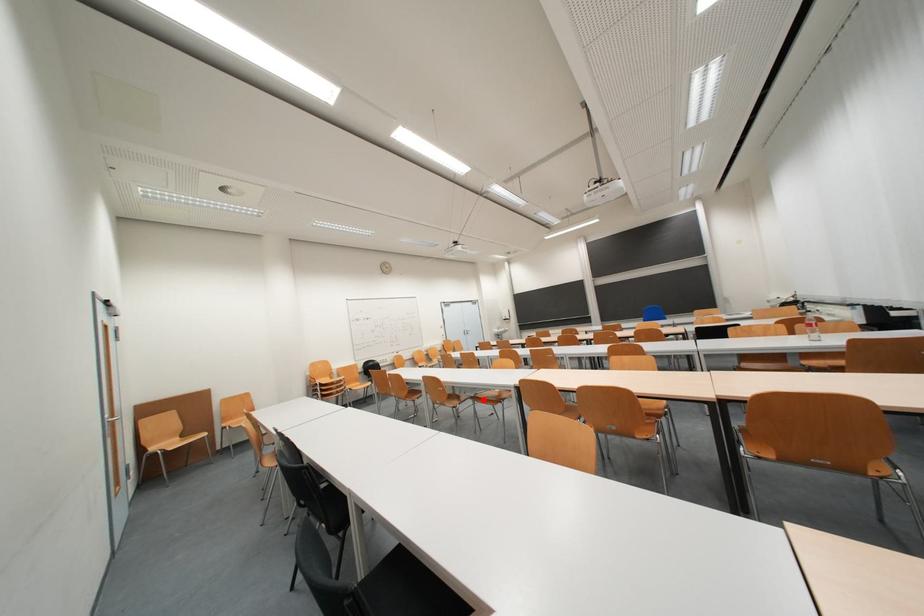
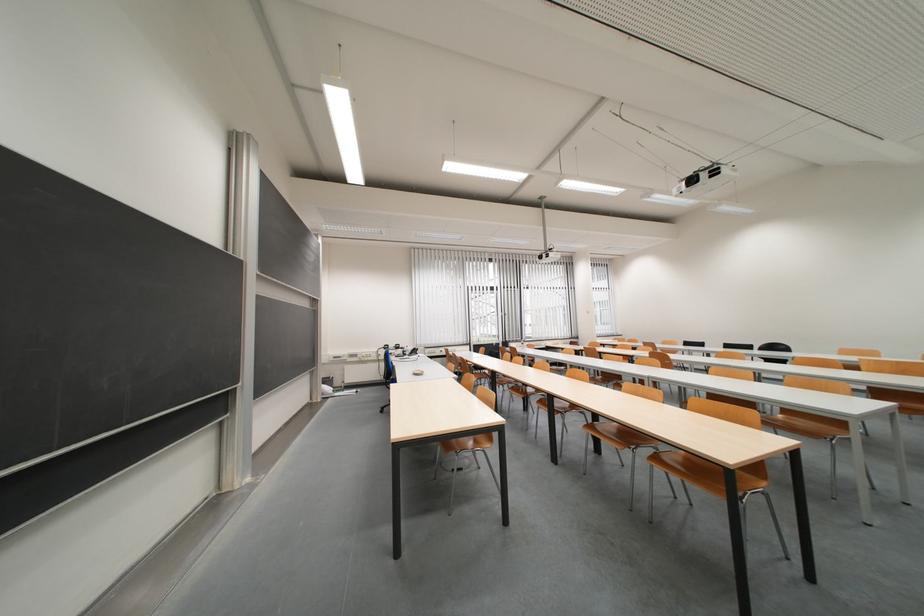
Question: I am providing you with two images of the same scene from different viewpoints. A red point is marked on the first image. Is the red point's position out of view in image 2?

Choices:
 (A) Yes
 (B) No

Answer: (A)